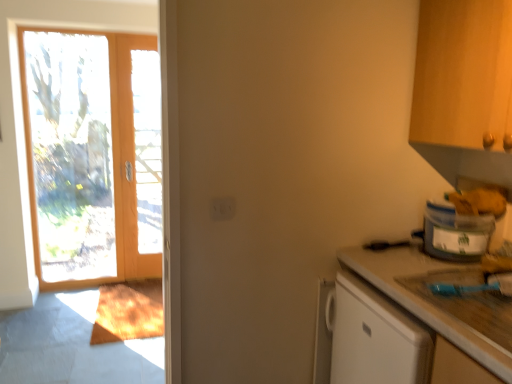
This screenshot has height=384, width=512. Find the location of `blank space situated above smooth beige countertop at lower right (from a real-world perspective)`. blank space situated above smooth beige countertop at lower right (from a real-world perspective) is located at coordinates (423, 272).